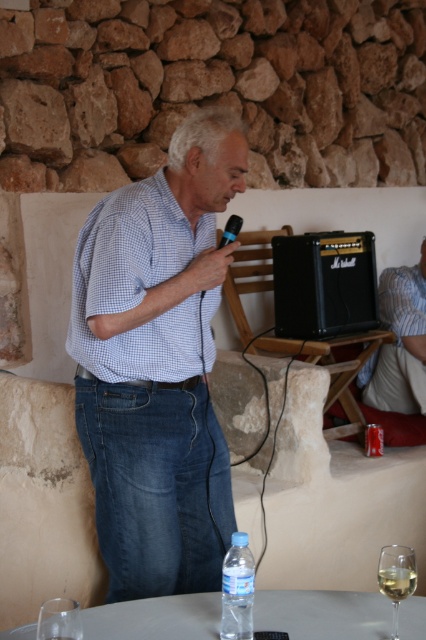
Based on the scene description, what is the 2D coordinate of the blue checkered shirt at center?

The blue checkered shirt at center is located at the 2D coordinate point of 0.569 in the x axis and 0.369 in the y axis.

You are a guest at this event and want to place a small gift on the table. Can you put it on the white glossy round table at lower center without moving the clear glass wine at lower center?

The white glossy round table at lower center is positioned on the right side of clear glass wine at lower center, so there is space to place the gift on the table without moving the wine.